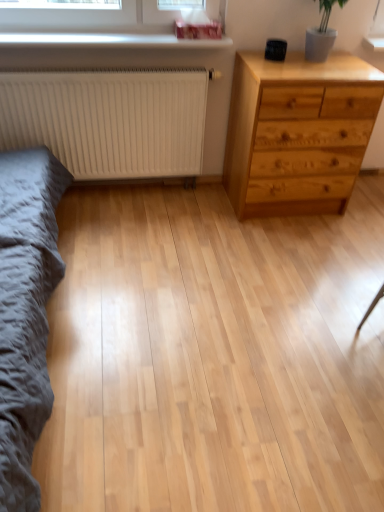
Question: Choose the correct answer: Is white glossy window sill at upper center inside natural wood chest of drawers at right or outside it?

Choices:
 (A) outside
 (B) inside

Answer: (A)

Question: Considering their positions, is white glossy window sill at upper center located in front of or behind natural wood chest of drawers at right?

Choices:
 (A) behind
 (B) front

Answer: (A)

Question: Which object is positioned closest to the natural wood chest of drawers at right?

Choices:
 (A) white matte radiator at left
 (B) white glossy window sill at upper center
 (C) dark gray fabric bed frame at left

Answer: (A)

Question: Considering the real-world distances, which object is closest to the white glossy window sill at upper center?

Choices:
 (A) white matte radiator at left
 (B) natural wood chest of drawers at right
 (C) dark gray fabric bed frame at left

Answer: (A)